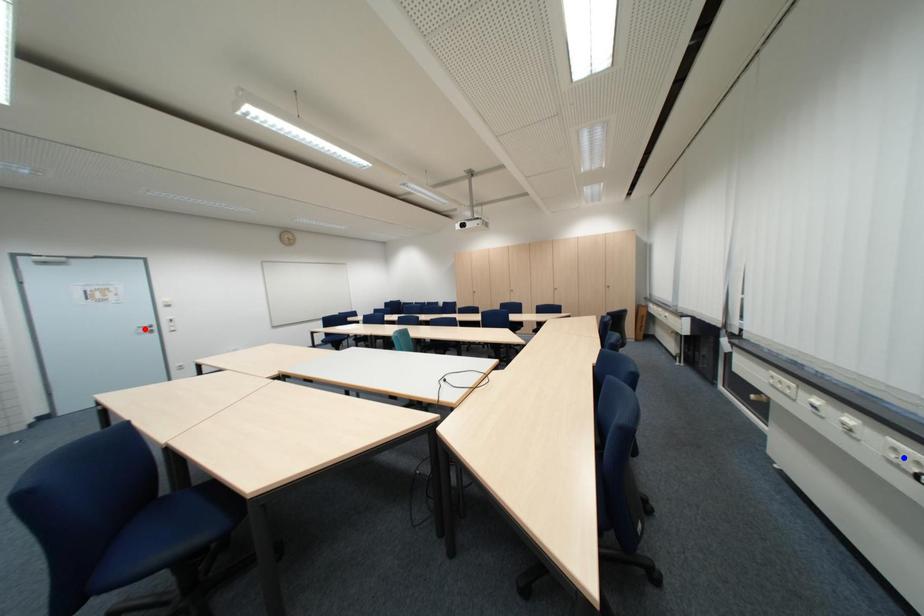
Question: Which of the two points in the image is closer to the camera?

Choices:
 (A) Blue point is closer.
 (B) Red point is closer.

Answer: (A)